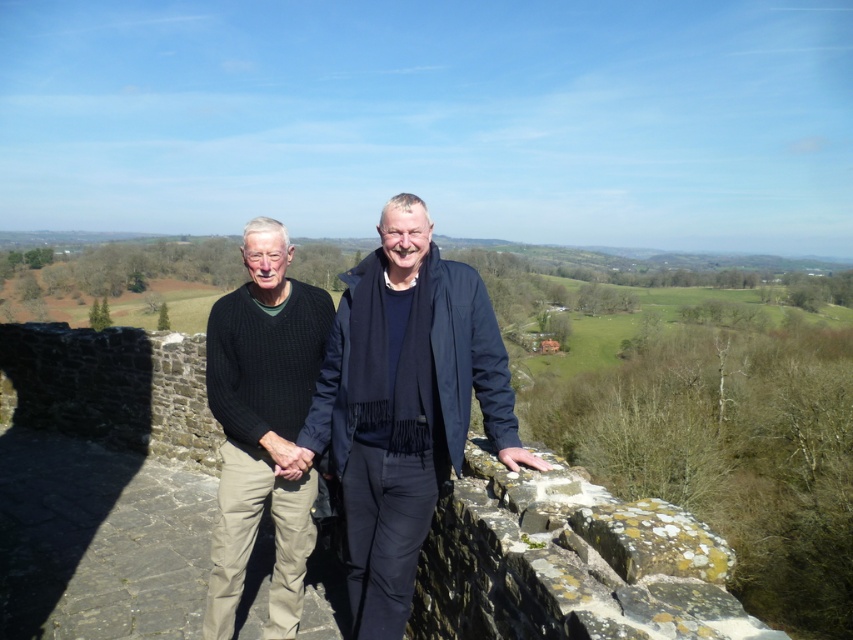
Can you confirm if knitted sweater at center is positioned to the right of black knitted sweater at left?

Yes, knitted sweater at center is to the right of black knitted sweater at left.

Describe the element at coordinates (402, 404) in the screenshot. I see `knitted sweater at center` at that location.

This screenshot has height=640, width=853. I want to click on knitted sweater at center, so click(x=402, y=404).